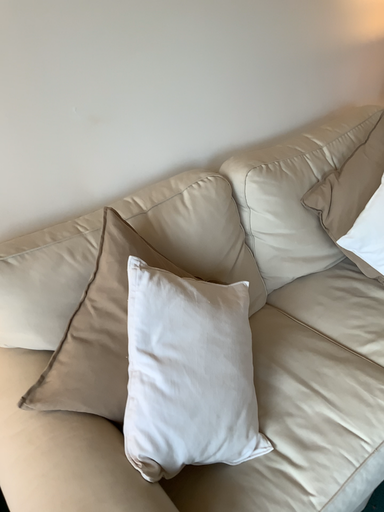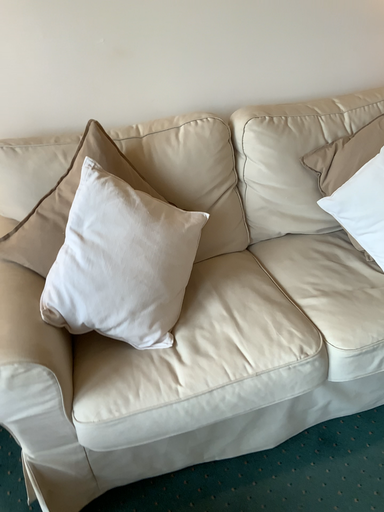
Question: How did the camera likely rotate when shooting the video?

Choices:
 (A) rotated left
 (B) rotated right

Answer: (A)